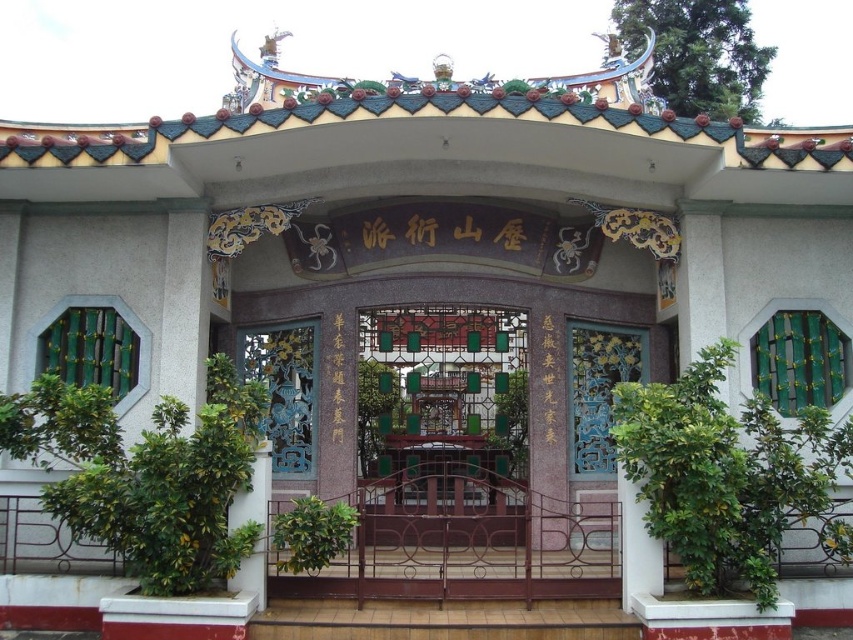
Question: Based on their relative distances, which object is farther from the blue carved wood door at right?

Choices:
 (A) white marble pillar at lower left
 (B) blue painted wood gate at center

Answer: (A)

Question: Does blue painted wood gate at center appear on the left side of blue carved wood door at right?

Choices:
 (A) no
 (B) yes

Answer: (B)

Question: Which object appears farthest from the camera in this image?

Choices:
 (A) blue painted wood gate at center
 (B) white marble pillar at lower left

Answer: (A)

Question: Does blue painted wood gate at center appear under white marble pillar at lower left?

Choices:
 (A) yes
 (B) no

Answer: (B)

Question: Considering the relative positions of blue painted wood gate at center and white marble pillar at lower left in the image provided, where is blue painted wood gate at center located with respect to white marble pillar at lower left?

Choices:
 (A) below
 (B) above

Answer: (B)

Question: Among these objects, which one is nearest to the camera?

Choices:
 (A) blue carved wood door at right
 (B) blue painted wood gate at center

Answer: (A)